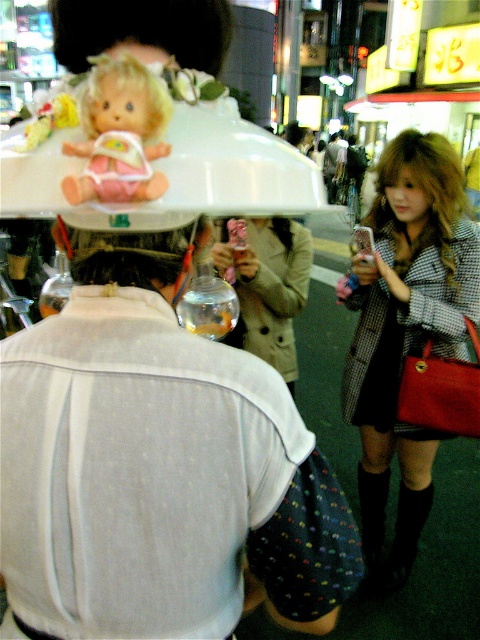
You are a photographer trying to capture a clear shot of the matte plastic doll at upper left and the brown leather hair at center. Which object should you focus on first if you want to ensure both are in focus without adjusting the camera settings?

The matte plastic doll at upper left is above the brown leather hair at center, so focusing on the brown leather hair at center first will ensure both are in focus since it is closer to the camera.

You are a photographer trying to capture both the tan leather jacket at center and the blonde hair doll at upper center in the same frame. Which object should you focus on first to ensure both are in focus?

You should focus on the tan leather jacket at center first because it is closer to you than the blonde hair doll at upper center. By focusing on the closer object, the farther one will also be in focus due to the depth of field.

In the urban night scene, there is a plaid wool coat at center right and a blonde hair doll at upper center. Based on their positions, can you determine which object is located to the right of the other?

The plaid wool coat at center right is to the right of the blonde hair doll at upper center.